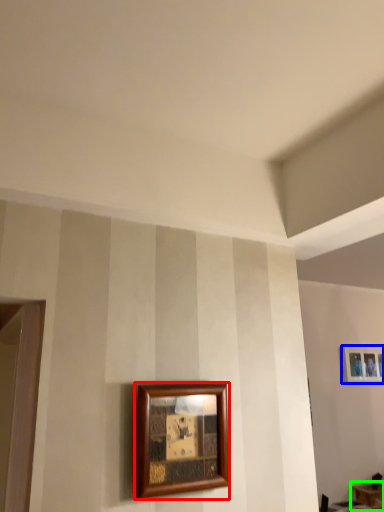
Question: Based on their relative distances, which object is farther from picture frame (highlighted by a red box)? Choose from picture frame (highlighted by a blue box) and table (highlighted by a green box).

Choices:
 (A) picture frame
 (B) table

Answer: (B)